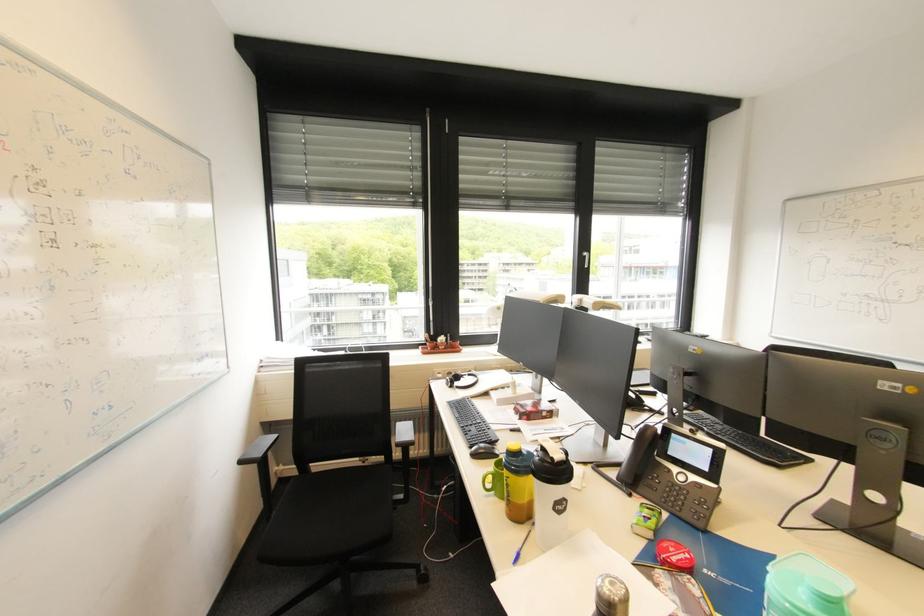
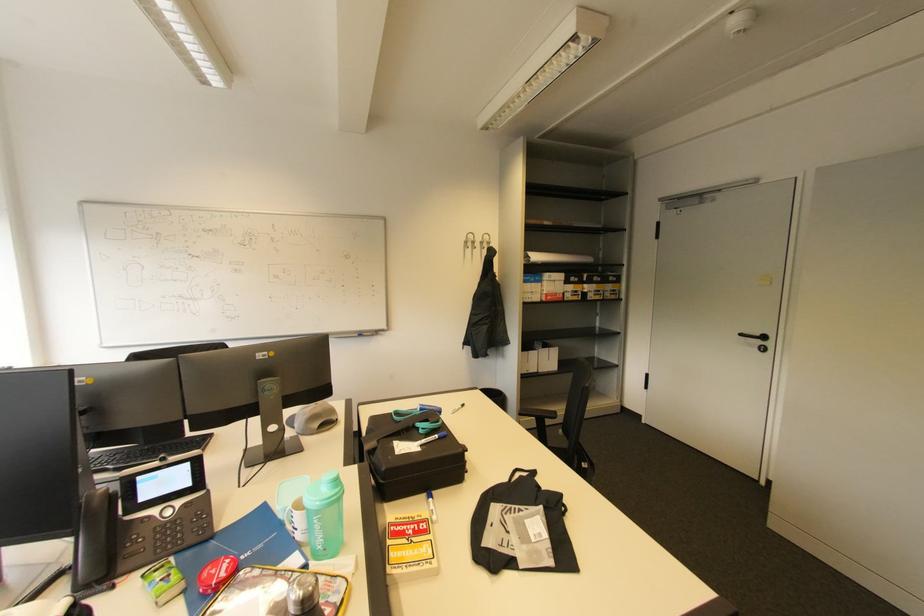
In the second image, find the point that corresponds to point (636, 483) in the first image.

(107, 575)